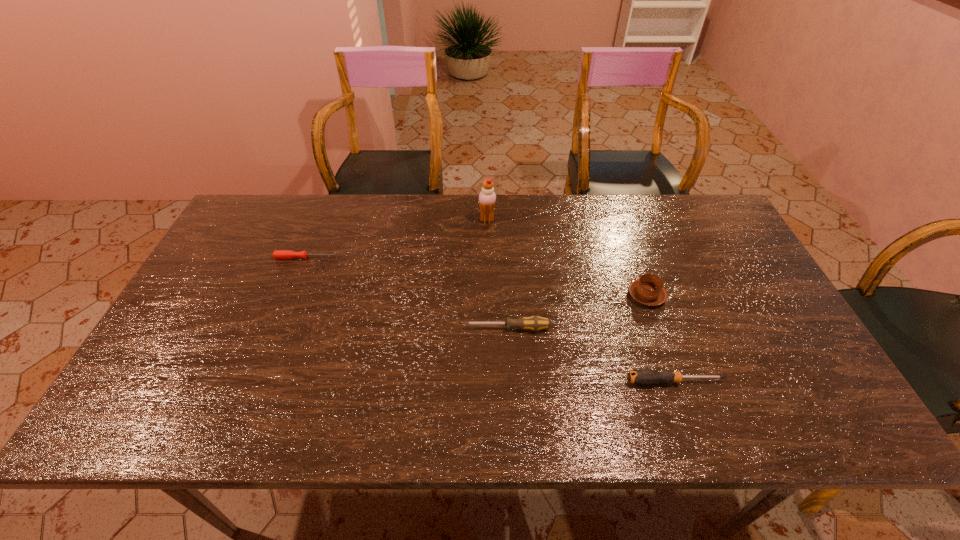
This screenshot has width=960, height=540. Find the location of `empty space between the farthest screwdriver and the tallest object`. empty space between the farthest screwdriver and the tallest object is located at coordinates (396, 239).

Find the location of a particular element. This screenshot has width=960, height=540. empty space between the third farthest object and the fourth nearest object is located at coordinates (476, 276).

The height and width of the screenshot is (540, 960). Find the location of `vacant space in between the cappuccino and the nearest screwdriver`. vacant space in between the cappuccino and the nearest screwdriver is located at coordinates (660, 338).

Find the location of `vacant point located between the fourth farthest object and the tallest object`. vacant point located between the fourth farthest object and the tallest object is located at coordinates (497, 274).

Where is `vacant space in between the leftmost object and the second farthest screwdriver`? The height and width of the screenshot is (540, 960). vacant space in between the leftmost object and the second farthest screwdriver is located at coordinates (407, 293).

Where is `vacant space in between the second farthest screwdriver and the nearest screwdriver`? vacant space in between the second farthest screwdriver and the nearest screwdriver is located at coordinates (591, 355).

Identify the location of free area in between the icecream and the second nearest object. (497, 274).

Point out which object is positioned as the second nearest to the icecream. Please provide its 2D coordinates. Your answer should be formatted as a tuple, i.e. [(x, y)], where the tuple contains the x and y coordinates of a point satisfying the conditions above.

[(649, 290)]

You are a GUI agent. You are given a task and a screenshot of the screen. Output one action in this format:
    pyautogui.click(x=<x>, y=<y>)
    Task: Click on the fourth closest object relative to the cappuccino
    
    Given the screenshot: What is the action you would take?
    pyautogui.click(x=278, y=254)

You are a GUI agent. You are given a task and a screenshot of the screen. Output one action in this format:
    pyautogui.click(x=<x>, y=<y>)
    Task: Click on the screwdriver that is the second closest to the third farthest object
    The height and width of the screenshot is (540, 960).
    Given the screenshot: What is the action you would take?
    pyautogui.click(x=535, y=323)